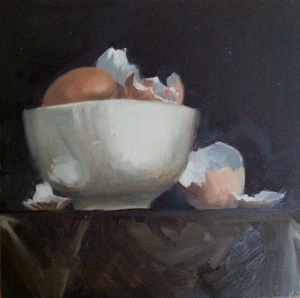
Where is `spot where bowl meets table`? The height and width of the screenshot is (298, 300). spot where bowl meets table is located at coordinates (130, 207).